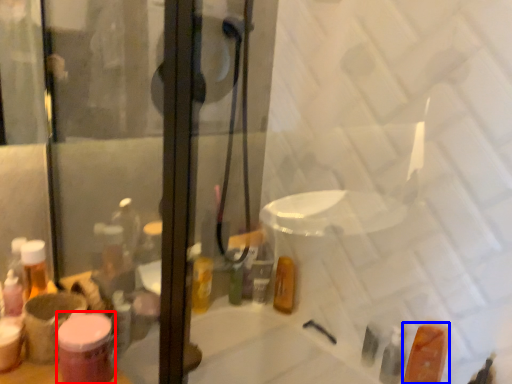
Question: Which object appears closest to the camera in this image, toiletry (highlighted by a red box) or toiletry (highlighted by a blue box)?

Choices:
 (A) toiletry
 (B) toiletry

Answer: (A)